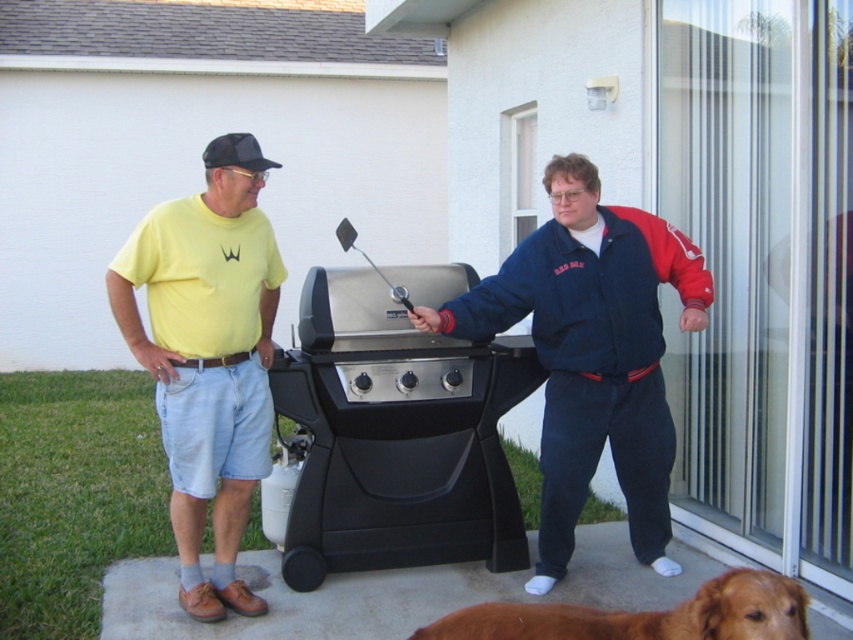
Is yellow cotton t-shirt at left positioned behind brown furry dog at lower right?

Yes, it is.

Based on the photo, does yellow cotton t-shirt at left have a lesser width compared to brown furry dog at lower right?

Yes.

Which is behind, point (198, 323) or point (699, 636)?

Positioned behind is point (198, 323).

Locate an element on the screen. yellow cotton t-shirt at left is located at coordinates (207, 356).

Does point (759, 172) come closer to viewer compared to point (505, 554)?

No, it is not.

Does transparent glass door at right have a greater height compared to black matte barbecue grill at center?

Indeed, transparent glass door at right has a greater height compared to black matte barbecue grill at center.

Locate an element on the screen. The width and height of the screenshot is (853, 640). transparent glass door at right is located at coordinates (763, 273).

Is point (633, 525) closer to viewer compared to point (744, 566)?

No, (633, 525) is behind (744, 566).

Is navy blue fleece jacket at center in front of brown furry dog at lower right?

No, navy blue fleece jacket at center is behind brown furry dog at lower right.

Does point (540, 536) lie in front of point (628, 636)?

No, (540, 536) is behind (628, 636).

This screenshot has width=853, height=640. What are the coordinates of `navy blue fleece jacket at center` in the screenshot? It's located at (592, 353).